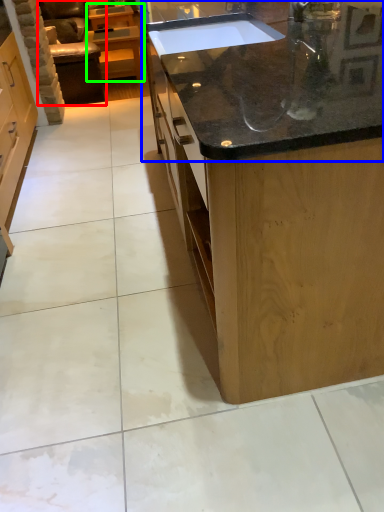
Question: Which object is the farthest from armchair (highlighted by a red box)? Choose among these: countertop (highlighted by a blue box) or cabinetry (highlighted by a green box).

Choices:
 (A) countertop
 (B) cabinetry

Answer: (A)